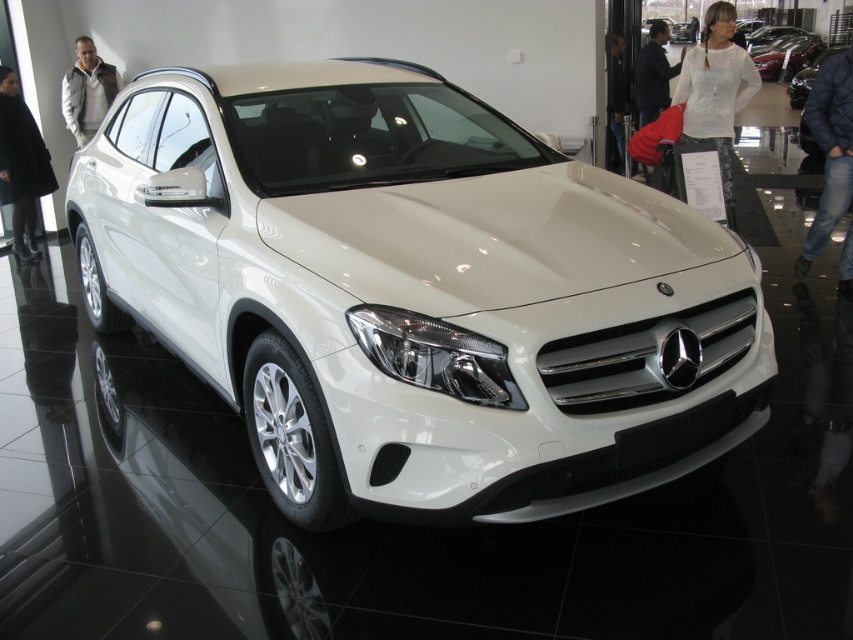
Question: Does white lace blouse at upper center have a lesser width compared to white fleece jacket at upper left?

Choices:
 (A) yes
 (B) no

Answer: (B)

Question: Is blue denim jeans at lower right below glossy metallic car at upper right?

Choices:
 (A) yes
 (B) no

Answer: (A)

Question: Which of the following is the farthest from the observer?

Choices:
 (A) white glossy suv at center
 (B) blue denim jeans at lower right

Answer: (B)

Question: Is white lace blouse at upper center wider than glossy metallic car at upper right?

Choices:
 (A) no
 (B) yes

Answer: (A)

Question: Which point is farther to the camera?

Choices:
 (A) (4, 144)
 (B) (569, 346)
 (C) (711, 20)
 (D) (799, 49)

Answer: (D)

Question: Which point is closer to the camera?

Choices:
 (A) blue denim jeans at lower right
 (B) glossy metallic car at upper right
 (C) black wool coat at left
 (D) black leather jacket at upper center

Answer: (A)